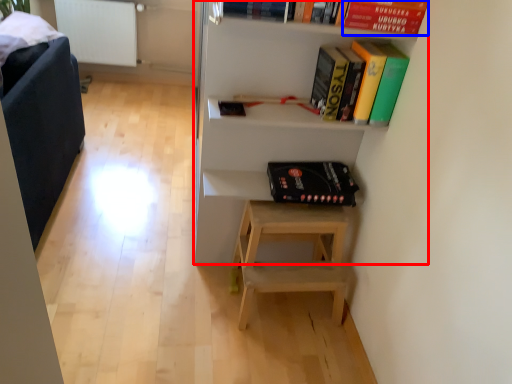
Question: Which object appears closest to the camera in this image, shelf (highlighted by a red box) or paperback book (highlighted by a blue box)?

Choices:
 (A) shelf
 (B) paperback book

Answer: (A)